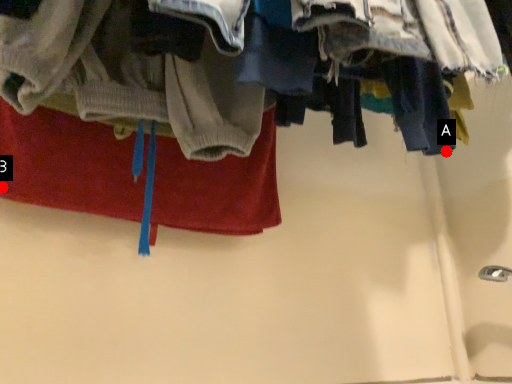
Question: Two points are circled on the image, labeled by A and B beside each circle. Which point is closer to the camera taking this photo?

Choices:
 (A) A is closer
 (B) B is closer

Answer: (A)